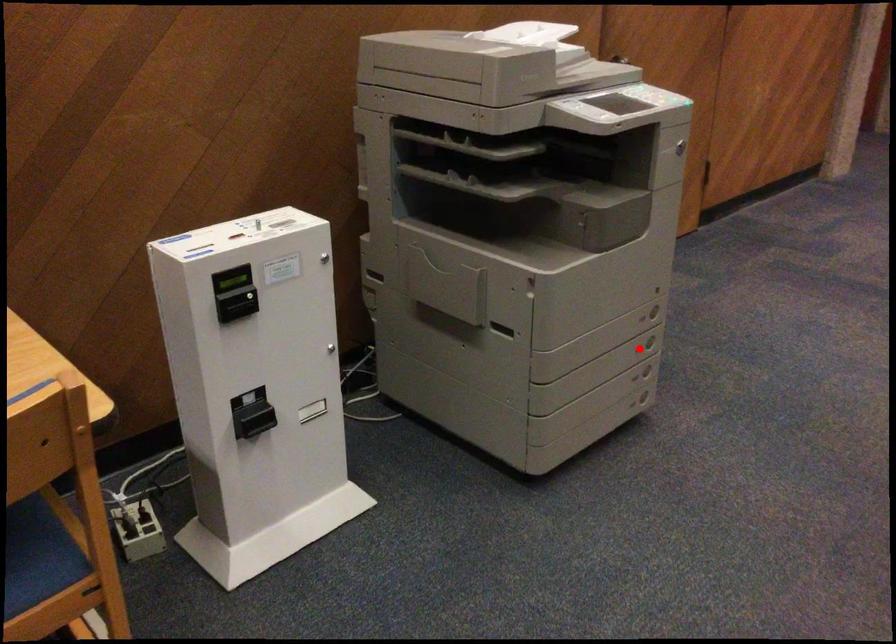
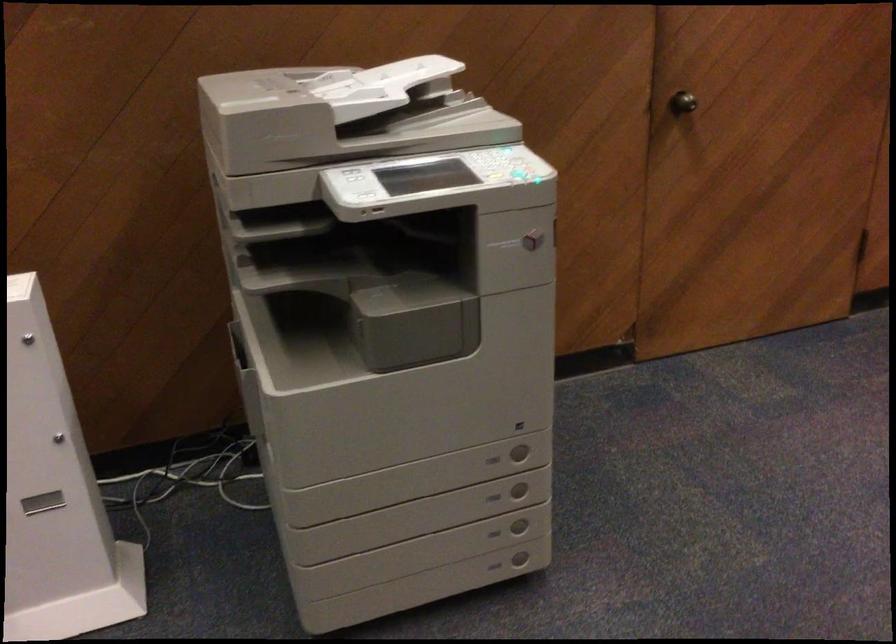
Question: I am providing you with two images of the same scene from different viewpoints. Image1 has a red point marked. In image2, the corresponding 3D location appears at what relative position? Reply with the corresponding letter.

Choices:
 (A) Closer
 (B) Farther

Answer: (A)